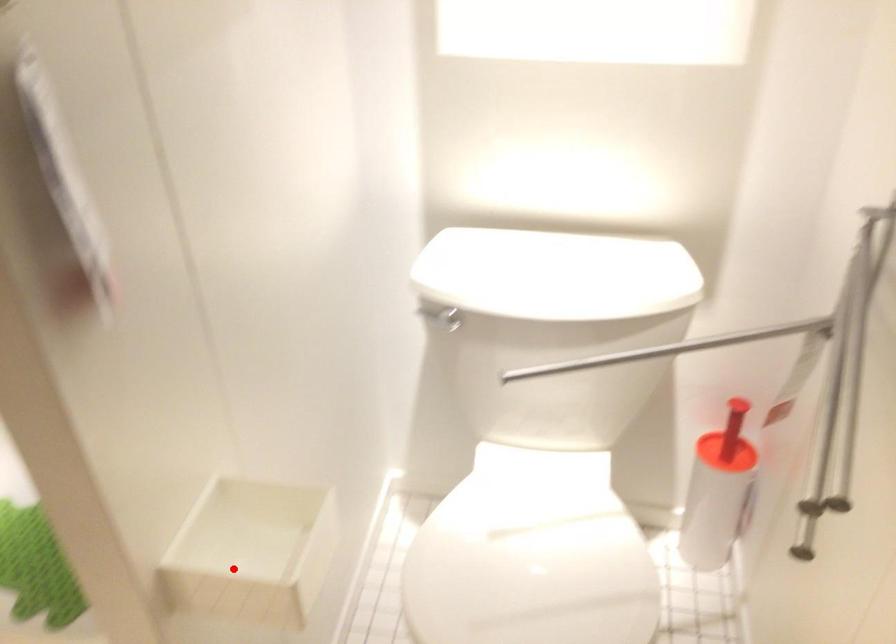
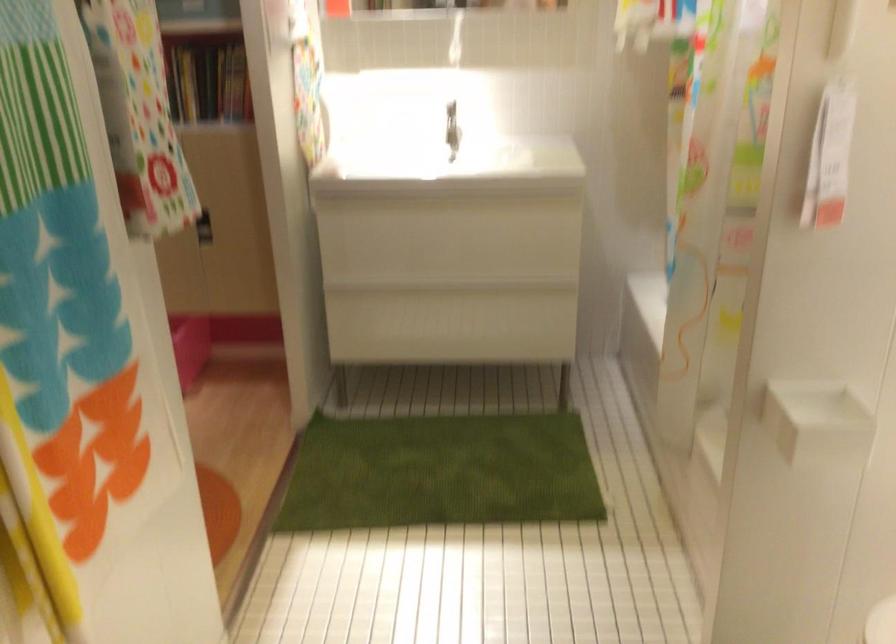
Question: A red point is marked in image1. In image2, is the corresponding 3D point closer to the camera or farther? Reply with the corresponding letter.

Choices:
 (A) The corresponding 3D point is closer.
 (B) The corresponding 3D point is farther.

Answer: (B)